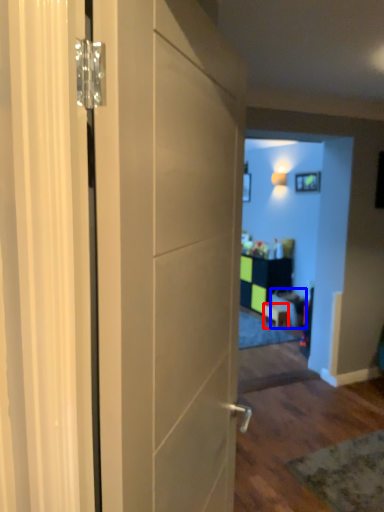
Question: Among these objects, which one is farthest to the camera, furniture (highlighted by a red box) or furniture (highlighted by a blue box)?

Choices:
 (A) furniture
 (B) furniture

Answer: (A)